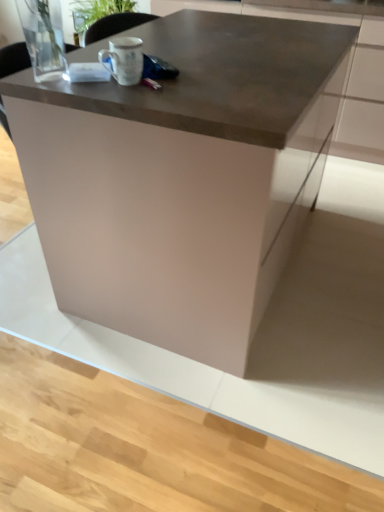
Question: Is satin metallic countertop at upper center not near white matte mug at upper center?

Choices:
 (A) yes
 (B) no

Answer: (A)

Question: From the image's perspective, is satin metallic countertop at upper center on top of white matte mug at upper center?

Choices:
 (A) yes
 (B) no

Answer: (A)

Question: Can you confirm if satin metallic countertop at upper center is positioned to the left of white matte mug at upper center?

Choices:
 (A) yes
 (B) no

Answer: (B)

Question: Is satin metallic countertop at upper center outside of white matte mug at upper center?

Choices:
 (A) no
 (B) yes

Answer: (B)

Question: Is satin metallic countertop at upper center to the right of white matte mug at upper center from the viewer's perspective?

Choices:
 (A) yes
 (B) no

Answer: (A)

Question: Does satin metallic countertop at upper center have a greater width compared to white matte mug at upper center?

Choices:
 (A) no
 (B) yes

Answer: (B)

Question: From a real-world perspective, is white matte mug at upper center on top of satin metallic countertop at upper center?

Choices:
 (A) yes
 (B) no

Answer: (A)

Question: From a real-world perspective, is white matte mug at upper center beneath satin metallic countertop at upper center?

Choices:
 (A) yes
 (B) no

Answer: (B)

Question: Considering the relative positions of white matte mug at upper center and satin metallic countertop at upper center in the image provided, is white matte mug at upper center to the left of satin metallic countertop at upper center from the viewer's perspective?

Choices:
 (A) yes
 (B) no

Answer: (A)

Question: Is white matte mug at upper center looking in the opposite direction of satin metallic countertop at upper center?

Choices:
 (A) yes
 (B) no

Answer: (B)

Question: From the image's perspective, is white matte mug at upper center beneath satin metallic countertop at upper center?

Choices:
 (A) no
 (B) yes

Answer: (B)

Question: Is white matte mug at upper center positioned in front of satin metallic countertop at upper center?

Choices:
 (A) yes
 (B) no

Answer: (A)

Question: From a real-world perspective, does white matte mug at upper center sit lower than matte brown table at center?

Choices:
 (A) yes
 (B) no

Answer: (B)